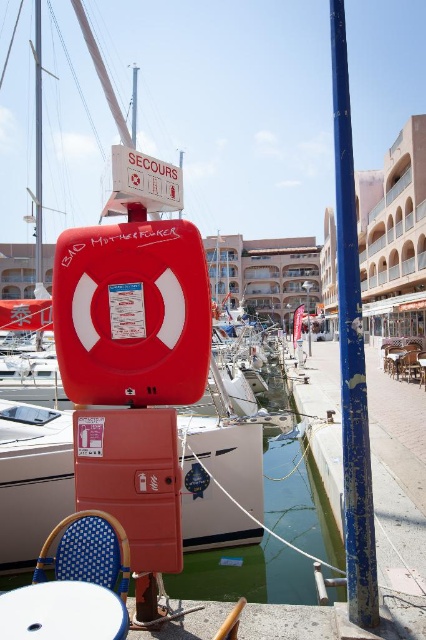
Does matte red lifebuoy at center lie in front of blue woven chair at lower left?

That is False.

Who is more distant from viewer, [238,428] or [86,525]?

Positioned behind is point [238,428].

This screenshot has height=640, width=426. What are the coordinates of `matte red lifebuoy at center` in the screenshot? It's located at (219, 481).

Who is higher up, matte red lifebuoy at center or transparent plastic water at lower center?

Positioned higher is matte red lifebuoy at center.

Is the position of matte red lifebuoy at center less distant than that of transparent plastic water at lower center?

Yes, matte red lifebuoy at center is in front of transparent plastic water at lower center.

Between point (198, 516) and point (290, 538), which one is positioned in front?

Point (198, 516)

Find the location of a particular element. matte red lifebuoy at center is located at coordinates [x=219, y=481].

Can you confirm if blue peeling paint pole at right is taller than blue woven chair at lower left?

Yes, blue peeling paint pole at right is taller than blue woven chair at lower left.

Is point (368, 576) in front of point (104, 524)?

No, it is behind (104, 524).

At what (x,y) coordinates should I click in order to perform the action: click on blue peeling paint pole at right. Please return your answer as a coordinate pair (x, y). The height and width of the screenshot is (640, 426). Looking at the image, I should click on (351, 353).